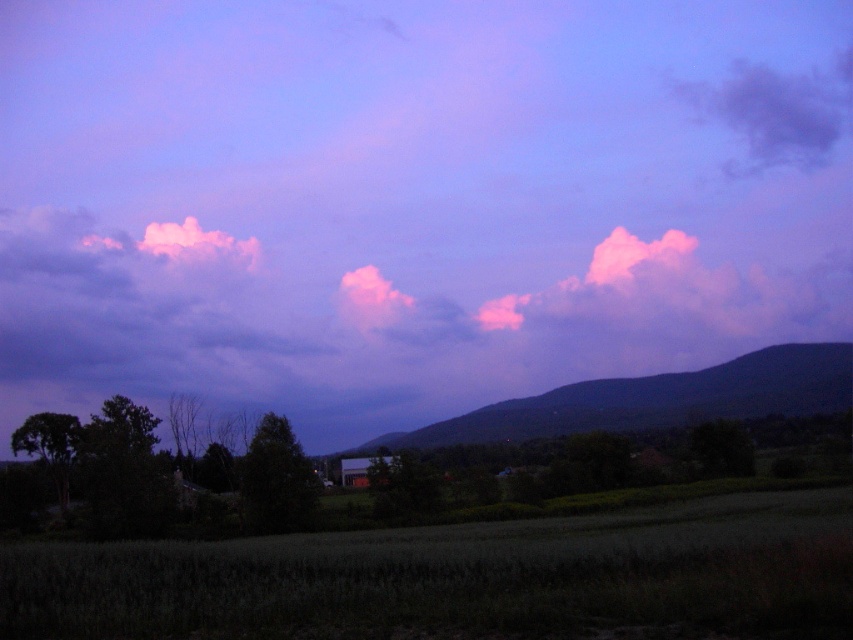
Looking at this image, who is positioned more to the right, dark purple mountain at center or purple cotton cloud at upper right?

purple cotton cloud at upper right

Which is in front, point (810, 353) or point (780, 106)?

Point (810, 353)

This screenshot has height=640, width=853. Find the location of `dark purple mountain at center`. dark purple mountain at center is located at coordinates (654, 401).

Where is `dark purple mountain at center`? Image resolution: width=853 pixels, height=640 pixels. dark purple mountain at center is located at coordinates (654, 401).

Is purple cloud at upper center smaller than purple cotton cloud at upper right?

Incorrect, purple cloud at upper center is not smaller in size than purple cotton cloud at upper right.

Is point (434, 38) closer to camera compared to point (672, 92)?

Yes, it is in front of point (672, 92).

The image size is (853, 640). I want to click on purple cloud at upper center, so click(410, 198).

Which is more to the right, purple cloud at upper center or green grassy field at lower center?

Positioned to the right is green grassy field at lower center.

Can you confirm if purple cloud at upper center is shorter than green grassy field at lower center?

In fact, purple cloud at upper center may be taller than green grassy field at lower center.

The image size is (853, 640). Find the location of `purple cloud at upper center`. purple cloud at upper center is located at coordinates (410, 198).